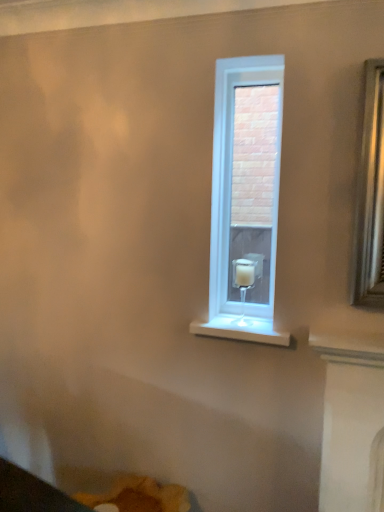
Question: Considering the relative positions of white glass window at center and white glass candle holder at center in the image provided, is white glass window at center to the right of white glass candle holder at center from the viewer's perspective?

Choices:
 (A) no
 (B) yes

Answer: (B)

Question: Is white glass window at center facing away from white glass candle holder at center?

Choices:
 (A) yes
 (B) no

Answer: (A)

Question: Is white glass window at center positioned far away from white glass candle holder at center?

Choices:
 (A) yes
 (B) no

Answer: (A)

Question: Is white glass window at center thinner than white glass candle holder at center?

Choices:
 (A) yes
 (B) no

Answer: (A)

Question: From the image's perspective, is white glass window at center located beneath white glass candle holder at center?

Choices:
 (A) no
 (B) yes

Answer: (A)

Question: Considering the relative sizes of white glass window at center and white glass candle holder at center in the image provided, is white glass window at center wider than white glass candle holder at center?

Choices:
 (A) no
 (B) yes

Answer: (A)

Question: From the image's perspective, is white glass candle holder at center under white glass window at center?

Choices:
 (A) yes
 (B) no

Answer: (A)

Question: Is there a large distance between white glass candle holder at center and white glass window at center?

Choices:
 (A) no
 (B) yes

Answer: (B)

Question: Is white glass candle holder at center at the right side of white glass window at center?

Choices:
 (A) no
 (B) yes

Answer: (A)

Question: Considering the relative sizes of white glass candle holder at center and white glass window at center in the image provided, is white glass candle holder at center smaller than white glass window at center?

Choices:
 (A) yes
 (B) no

Answer: (A)

Question: Is white glass candle holder at center at the left side of white glass window at center?

Choices:
 (A) no
 (B) yes

Answer: (B)

Question: From the image's perspective, is white glass candle holder at center over white glass window at center?

Choices:
 (A) no
 (B) yes

Answer: (A)

Question: In terms of width, does white glass window at center look wider or thinner when compared to white glass candle holder at center?

Choices:
 (A) wide
 (B) thin

Answer: (B)